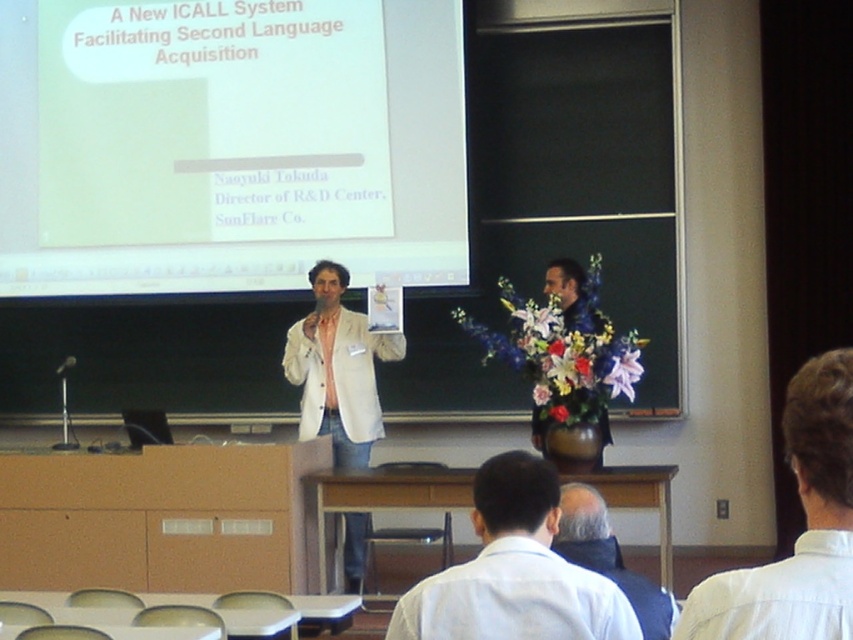
Question: Which point is farther from the camera taking this photo?

Choices:
 (A) (546, 541)
 (B) (573, 524)

Answer: (B)

Question: Observing the image, what is the correct spatial positioning of white matte projector screen at upper center in reference to dark blue jacket at lower center?

Choices:
 (A) left
 (B) right

Answer: (A)

Question: Which point appears farthest from the camera in this image?

Choices:
 (A) (364, 524)
 (B) (587, 572)

Answer: (A)

Question: Where is white shirt at lower center located in relation to white matte lab coat at center in the image?

Choices:
 (A) right
 (B) left

Answer: (A)

Question: Does white shirt at lower center appear on the left side of white shirt at lower right?

Choices:
 (A) yes
 (B) no

Answer: (A)

Question: Which point is closer to the camera?

Choices:
 (A) (708, 589)
 (B) (548, 552)
 (C) (337, 406)
 (D) (622, 577)

Answer: (A)